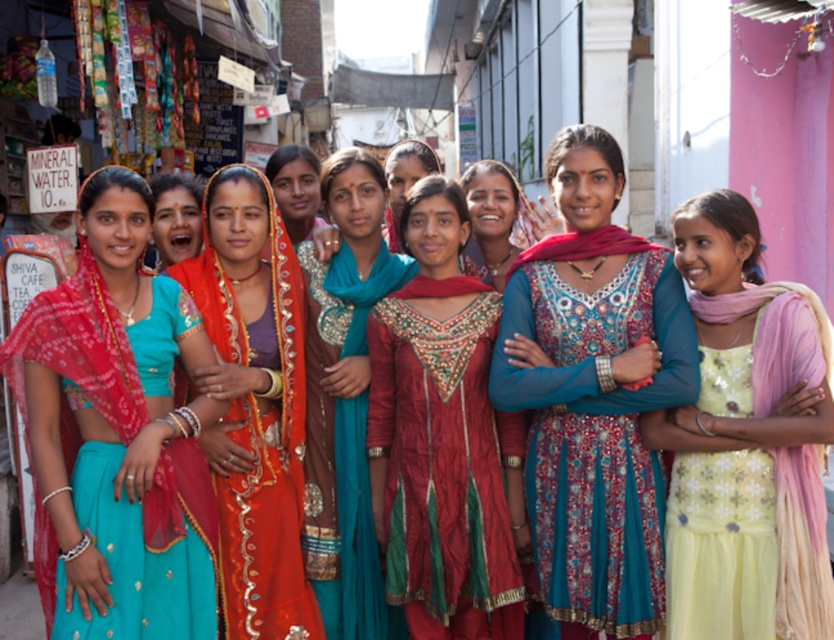
You are a photographer trying to capture a clear shot of the teal silk scarf at center and the matte red scarf at center. Which scarf is blocking the view of the other?

The teal silk scarf at center is in front of the matte red scarf at center, so it is blocking the view of the matte red scarf at center.

You are a photographer trying to capture the women in the scene. You notice the shiny red dress at center and the matte red scarf at center. Which object is located lower in the image?

The shiny red dress at center is positioned under the matte red scarf at center, so it is located lower in the image.